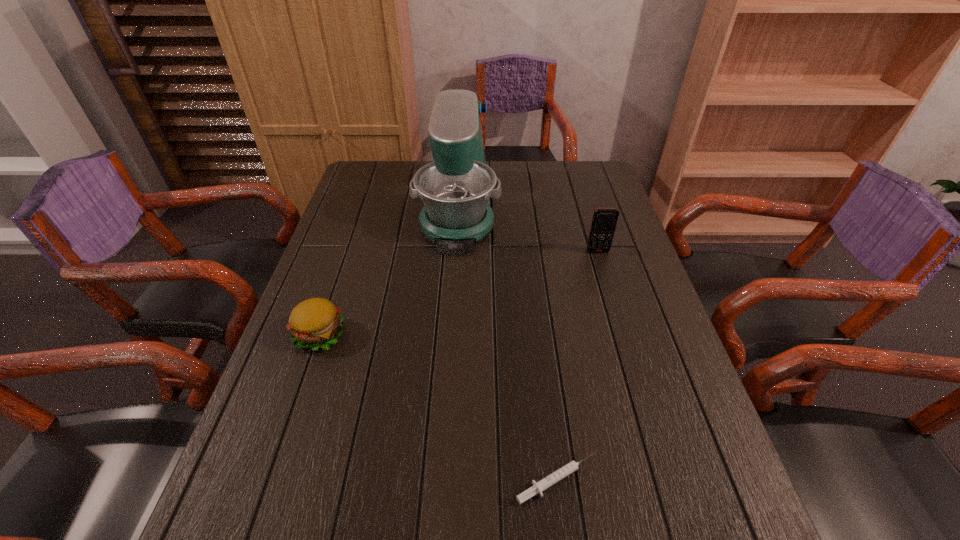
You are a GUI agent. You are given a task and a screenshot of the screen. Output one action in this format:
    pyautogui.click(x=<x>, y=<y>)
    Task: Click on the mixer
    
    Given the screenshot: What is the action you would take?
    pyautogui.click(x=456, y=187)

Locate an element on the screen. The width and height of the screenshot is (960, 540). the rightmost object is located at coordinates (604, 221).

Locate an element on the screen. Image resolution: width=960 pixels, height=540 pixels. the second tallest object is located at coordinates (604, 221).

The width and height of the screenshot is (960, 540). I want to click on hamburger, so click(316, 322).

The height and width of the screenshot is (540, 960). What are the coordinates of `the leftmost object` in the screenshot? It's located at (316, 322).

This screenshot has width=960, height=540. In order to click on the nearest object in this screenshot , I will do `click(537, 488)`.

Locate an element on the screen. The width and height of the screenshot is (960, 540). the shortest object is located at coordinates (537, 488).

The width and height of the screenshot is (960, 540). Identify the location of free space located 0.360m on the front-facing side of the tallest object. click(x=448, y=355).

This screenshot has height=540, width=960. Find the location of `free location located on the screen of the cellular telephone`. free location located on the screen of the cellular telephone is located at coordinates (607, 282).

Image resolution: width=960 pixels, height=540 pixels. What are the coordinates of `free point located on the back of the hamburger` in the screenshot? It's located at click(x=338, y=282).